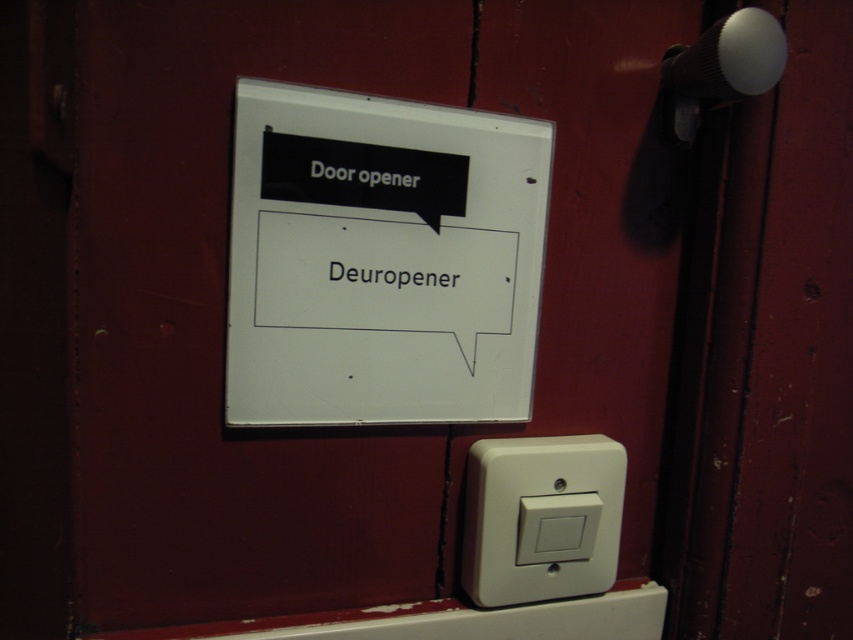
You are a delivery robot with a camera mounted on top of you. You need to scan the white plastic sign at upper center to open the door. Can your camera reach it?

The white plastic sign at upper center and camera are 23.52 inches apart from each other. Since the distance is sufficient for the camera to capture the sign, the robot can reach the white plastic sign at upper center.